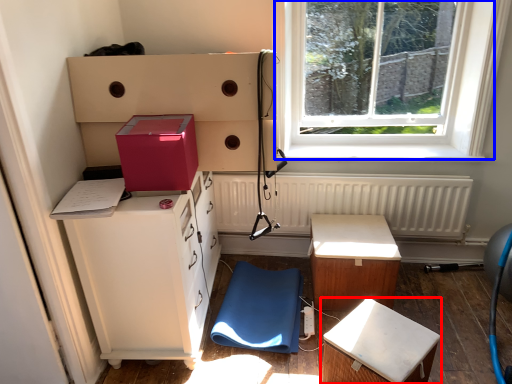
Question: Among these objects, which one is farthest to the camera, furniture (highlighted by a red box) or window (highlighted by a blue box)?

Choices:
 (A) furniture
 (B) window

Answer: (B)